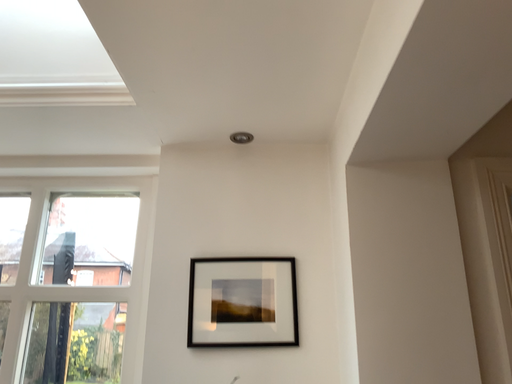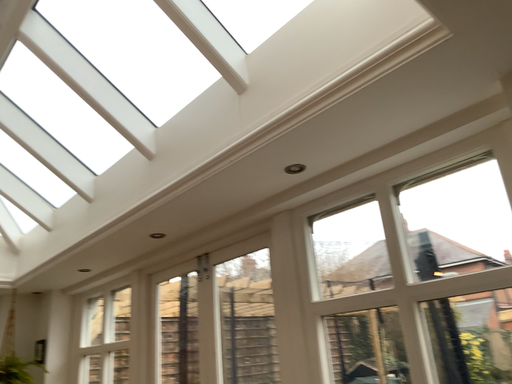
Question: Which way did the camera rotate in the video?

Choices:
 (A) rotated downward
 (B) rotated upward

Answer: (A)